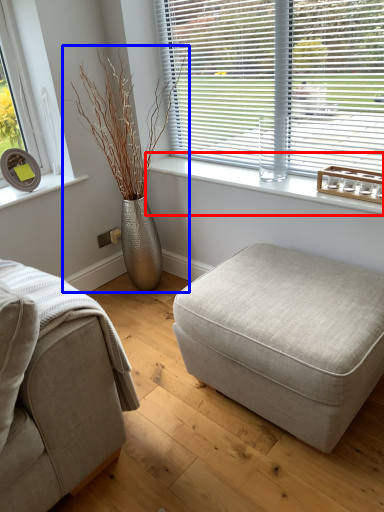
Question: Which object is closer to the camera taking this photo, window sill (highlighted by a red box) or houseplant (highlighted by a blue box)?

Choices:
 (A) window sill
 (B) houseplant

Answer: (A)